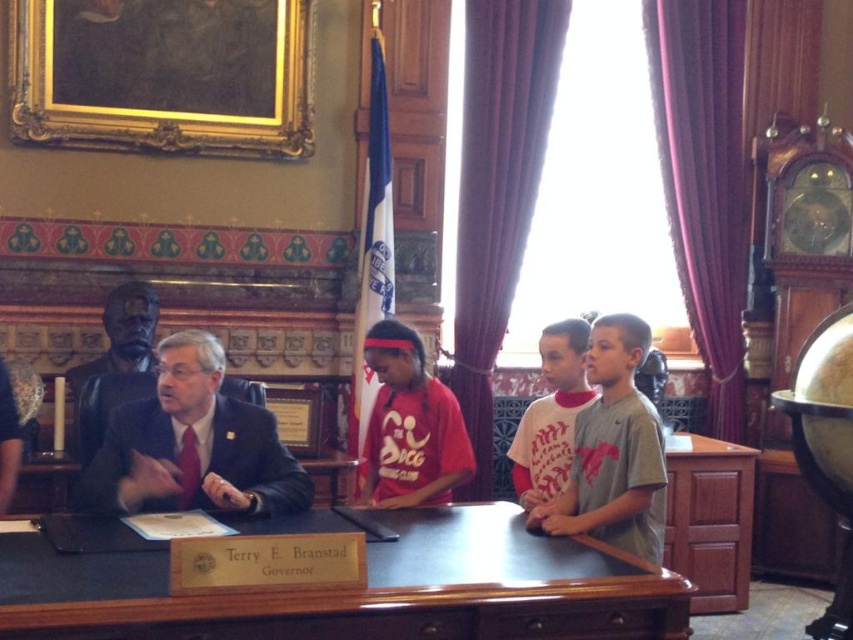
You are organizing a charity event and need to display two shirts on a mannequin. The red cotton shirt at center and the white cotton shirt at center must be arranged side by side. Which shirt should you place on the left to ensure they fit within a 1.2 meter display area?

The red cotton shirt at center is wider than the white cotton shirt at center. To fit within the 1.2 meter display area, place the narrower white cotton shirt at center on the left and the wider red cotton shirt at center on the right so they occupy less space combined.